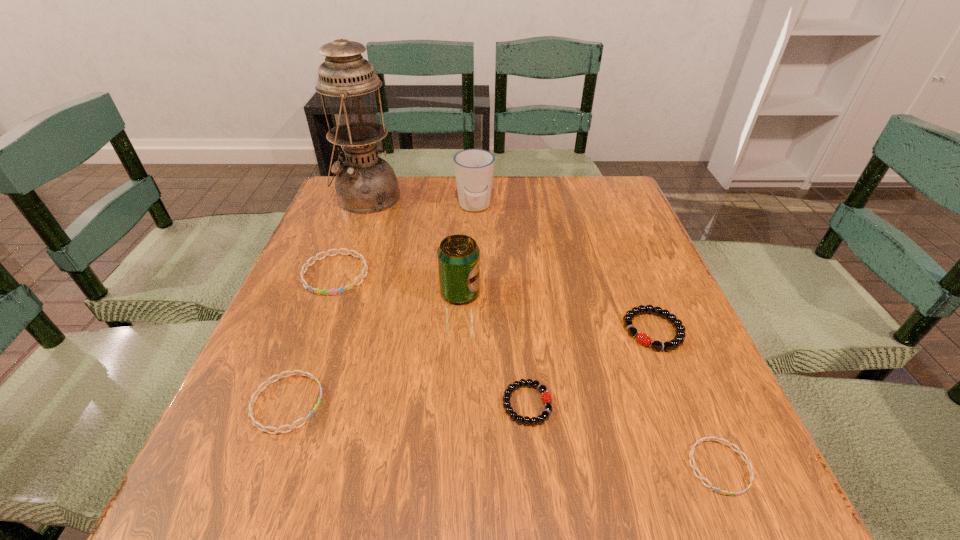
Image resolution: width=960 pixels, height=540 pixels. Identify the location of oil lamp. (365, 183).

Locate an element on the screen. Image resolution: width=960 pixels, height=540 pixels. cup is located at coordinates (474, 168).

Where is `beer can`? The image size is (960, 540). beer can is located at coordinates (458, 255).

Identify the location of the farthest bracelet. The image size is (960, 540). (341, 290).

Find the location of a particular element. The image size is (960, 540). the farthest blue bracelet is located at coordinates (341, 290).

At what (x,y) coordinates should I click in order to perform the action: click on the right black bracelet. Please return your answer as a coordinate pair (x, y). The image size is (960, 540). Looking at the image, I should click on (642, 338).

Where is `the farther black bracelet`? the farther black bracelet is located at coordinates (642, 338).

In order to click on the second smallest blue bracelet in this screenshot , I will do `click(255, 423)`.

Find the location of a particular element. The height and width of the screenshot is (540, 960). the left black bracelet is located at coordinates (546, 396).

What are the coordinates of `the smaller black bracelet` in the screenshot? It's located at (546, 396).